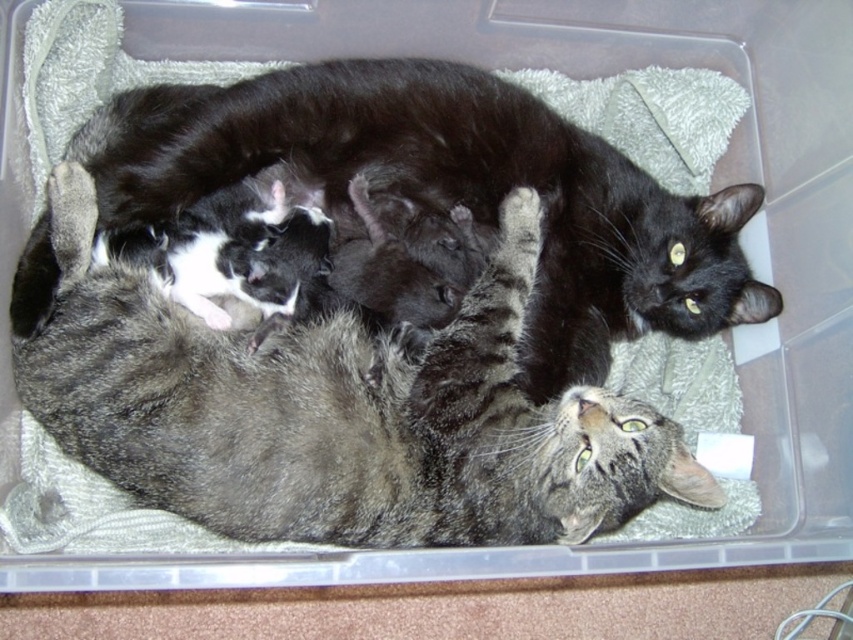
You are a photographer trying to capture a closeup of the tabby fur cat at center and the black fur cat at upper center. Since you can only focus on one cat at a time, which one should you focus on to ensure the other is still in the background?

You should focus on the black fur cat at upper center because the tabby fur cat at center is located below it, so the tabby fur cat at center will be in the background.

Based on the coordinates provided in the scene, where exactly is the tabby fur cat at center located?

The tabby fur cat at center is located at the 2D coordinates point (339, 412).

You are a photographer trying to capture the tabby fur cat at center. You notice a point marked at coordinates (339, 412). Is this point likely to be a good focus point for your camera to ensure the tabby fur cat at center is in sharp focus?

The point marked at coordinates (339, 412) marks the tabby fur cat at center, so yes, this point is a good focus point to ensure the tabby fur cat at center is in sharp focus.